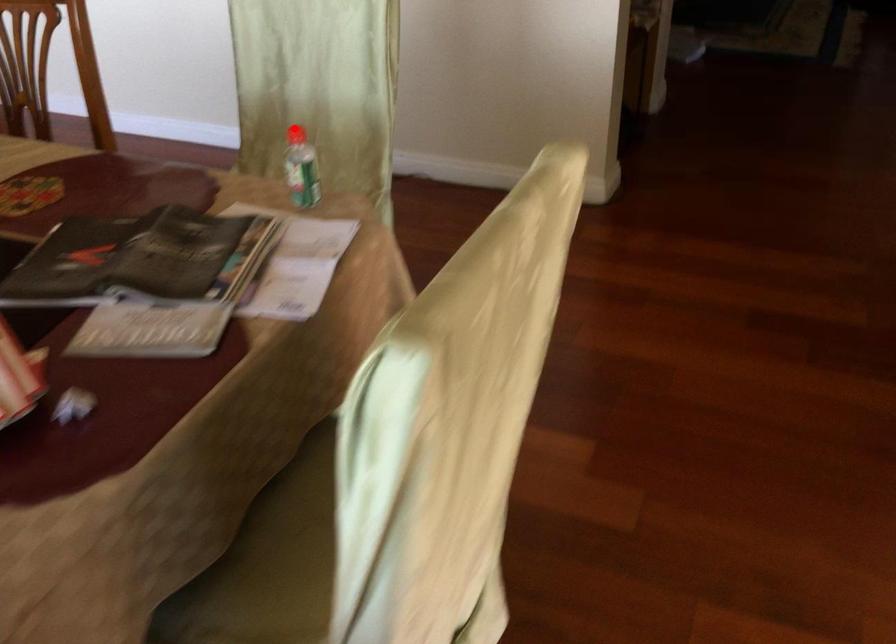
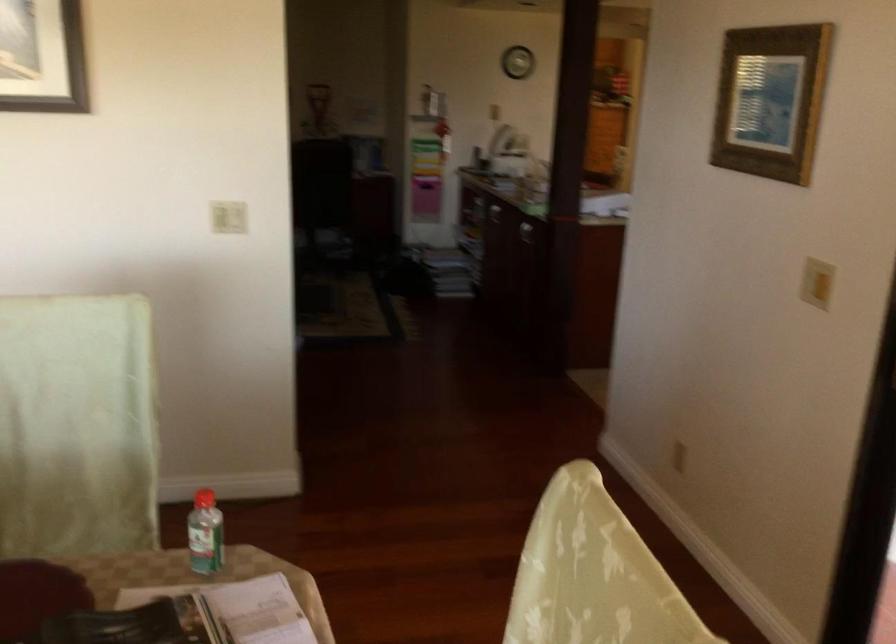
The point at the highlighted location is marked in the first image. Where is the corresponding point in the second image?

(203, 498)